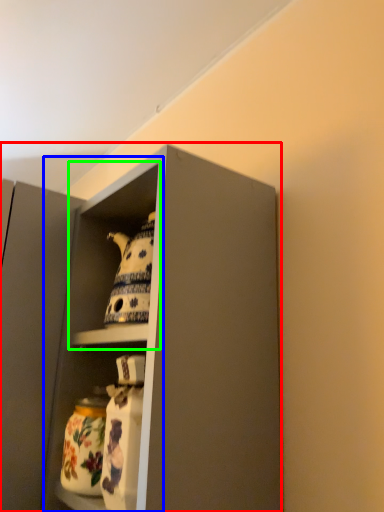
Question: Estimate the real-world distances between objects in this image. Which object is closer to cabinetry (highlighted by a red box), cabinet (highlighted by a blue box) or cabinet (highlighted by a green box)?

Choices:
 (A) cabinet
 (B) cabinet

Answer: (B)